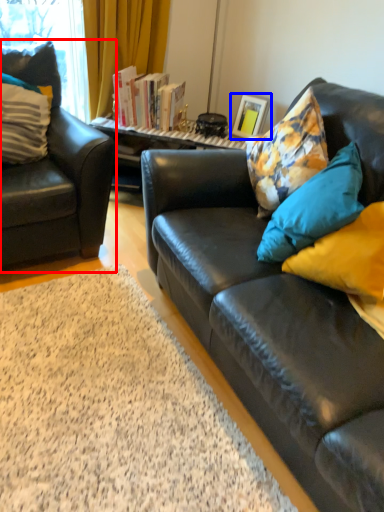
Question: Which object appears farthest to the camera in this image, chair (highlighted by a red box) or picture frame (highlighted by a blue box)?

Choices:
 (A) chair
 (B) picture frame

Answer: (B)